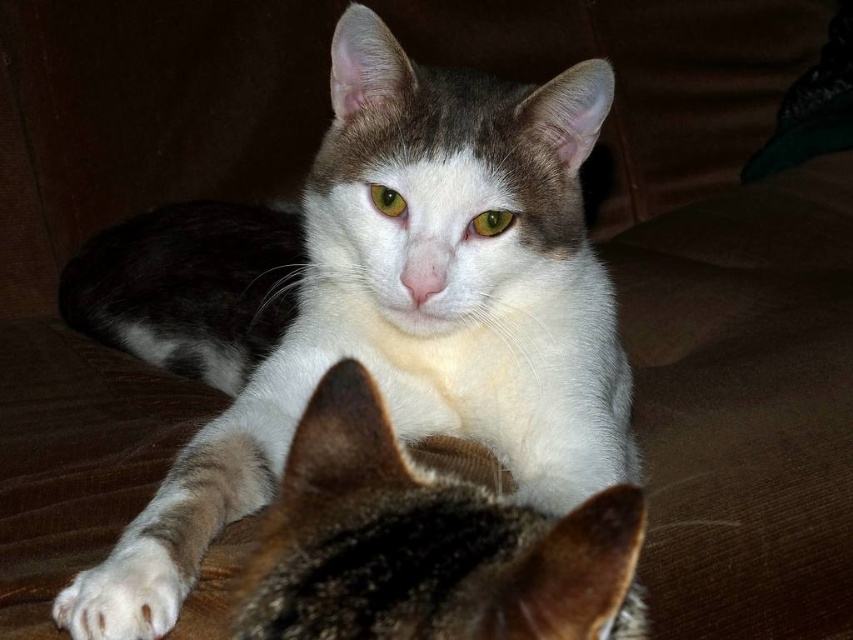
Which is above, white fur cat at center or white fur at center?

Positioned higher is white fur cat at center.

Can you confirm if white fur cat at center is positioned to the right of white fur at center?

In fact, white fur cat at center is to the left of white fur at center.

Identify the location of white fur cat at center. (386, 288).

This screenshot has width=853, height=640. What do you see at coordinates (386, 288) in the screenshot? I see `white fur cat at center` at bounding box center [386, 288].

Does white fur cat at center appear on the right side of white fluffy paw at lower left?

No, white fur cat at center is not to the right of white fluffy paw at lower left.

The height and width of the screenshot is (640, 853). I want to click on white fur cat at center, so click(x=386, y=288).

Is the position of white fur at center more distant than that of white fluffy paw at lower left?

No, it is in front of white fluffy paw at lower left.

Based on the photo, which is more to the left, white fur at center or white fluffy paw at lower left?

Positioned to the left is white fluffy paw at lower left.

At what (x,y) coordinates should I click in order to perform the action: click on white fur at center. Please return your answer as a coordinate pair (x, y). The height and width of the screenshot is (640, 853). Looking at the image, I should click on (427, 545).